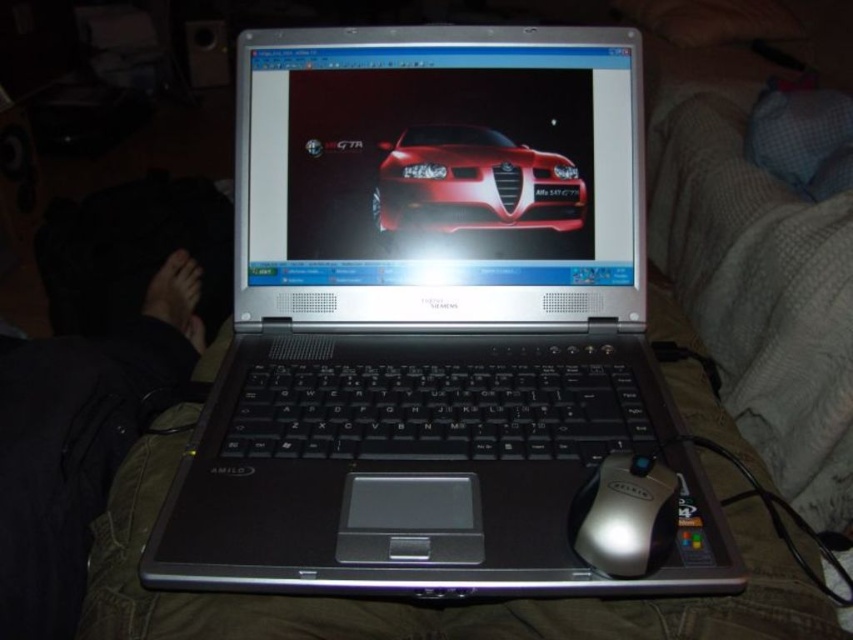
Question: Is glossy red car at center positioned before silver metallic mouse at center?

Choices:
 (A) yes
 (B) no

Answer: (B)

Question: Estimate the real-world distances between objects in this image. Which object is farther from the silver/black plastic laptop at center?

Choices:
 (A) silver metallic mouse at center
 (B) glossy red car at center

Answer: (A)

Question: Which point is farther to the camera?

Choices:
 (A) (378, 83)
 (B) (412, 204)
 (C) (607, 456)

Answer: (B)

Question: Which is nearer to the silver metallic mouse at center?

Choices:
 (A) glossy red car at center
 (B) silver/black plastic laptop at center

Answer: (B)

Question: Is glossy red car at center to the right of silver metallic mouse at center from the viewer's perspective?

Choices:
 (A) no
 (B) yes

Answer: (A)

Question: Observing the image, what is the correct spatial positioning of silver/black plastic laptop at center in reference to glossy red car at center?

Choices:
 (A) right
 (B) left

Answer: (B)